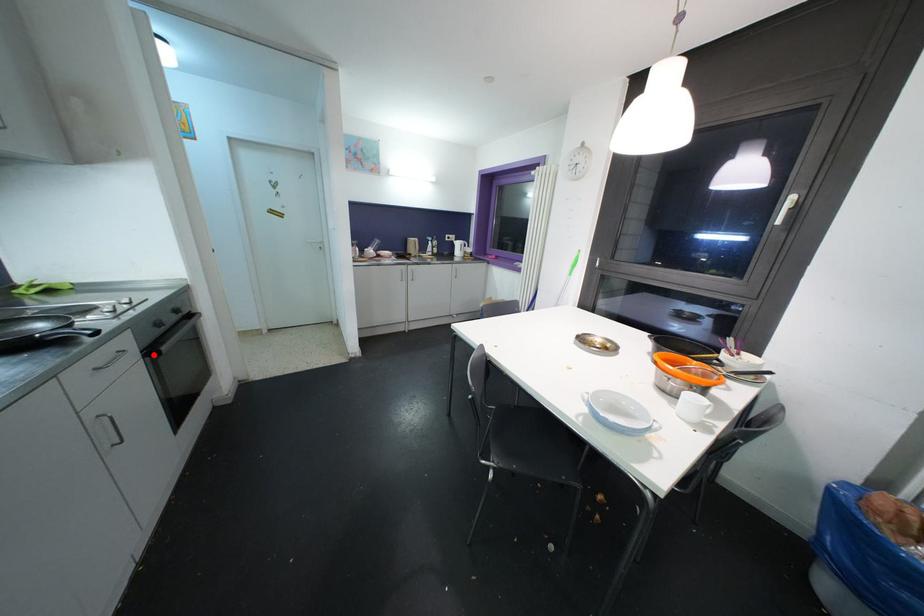
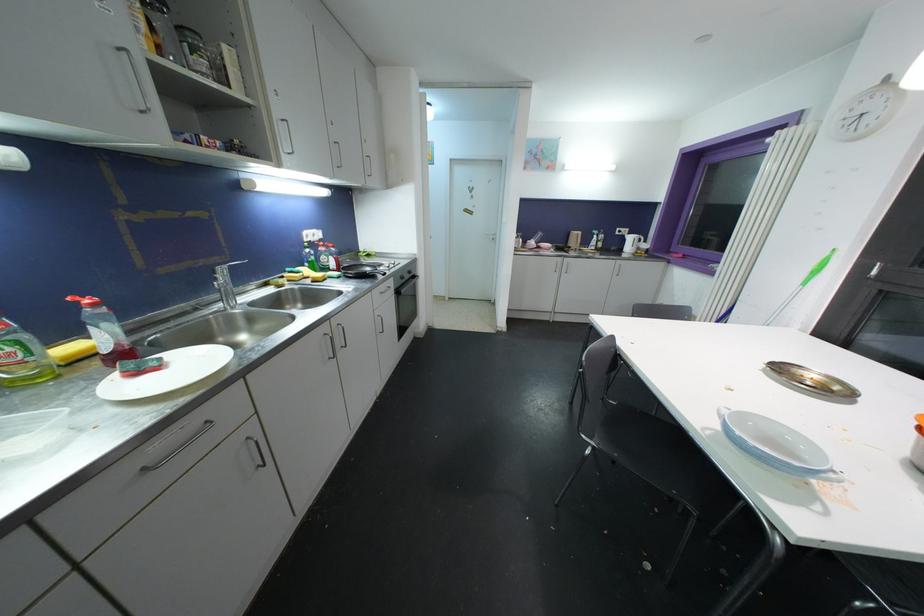
Question: I am providing you with two images of the same scene from different viewpoints. Image1 has a red point marked. In image2, the corresponding 3D location appears at what relative position? Reply with the corresponding letter.

Choices:
 (A) Closer
 (B) Farther

Answer: (A)